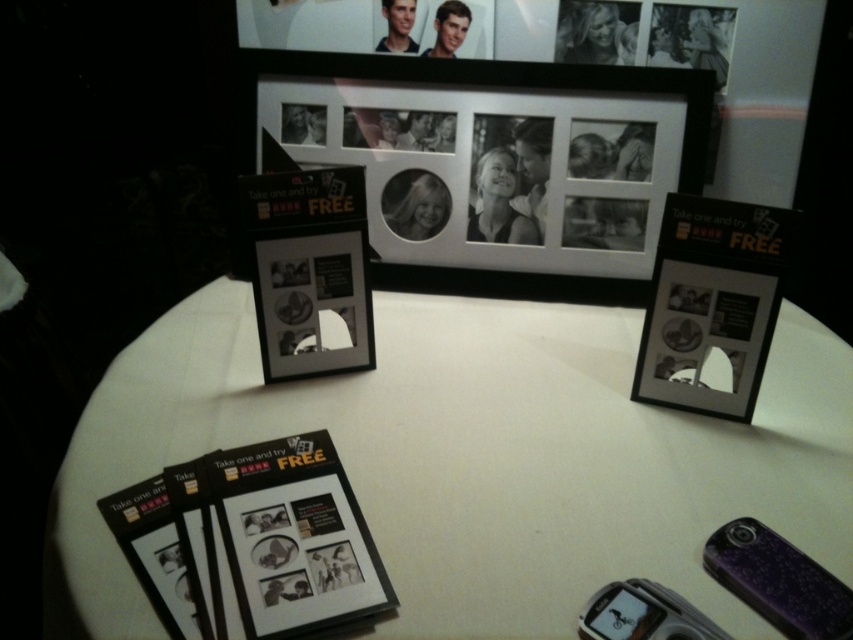
This screenshot has height=640, width=853. Describe the element at coordinates (471, 460) in the screenshot. I see `white matte table at center` at that location.

Does white matte table at center appear on the left side of black matte picture frame at upper center?

No, white matte table at center is not to the left of black matte picture frame at upper center.

This screenshot has width=853, height=640. Find the location of `white matte table at center`. white matte table at center is located at coordinates (471, 460).

Can you confirm if white matte table at center is bigger than matte plastic picture frame at center?

Correct, white matte table at center is larger in size than matte plastic picture frame at center.

Does white matte table at center have a smaller size compared to matte plastic picture frame at center?

Actually, white matte table at center might be larger than matte plastic picture frame at center.

Identify the location of white matte table at center. (471, 460).

Is black matte picture frame at upper center wider than matte plastic picture frame at center?

Yes, black matte picture frame at upper center is wider than matte plastic picture frame at center.

Which is above, black matte picture frame at upper center or matte plastic picture frame at center?

Positioned higher is black matte picture frame at upper center.

Who is more forward, (x=608, y=177) or (x=296, y=340)?

Point (x=296, y=340)

Locate an element on the screen. This screenshot has width=853, height=640. black matte picture frame at upper center is located at coordinates (492, 156).